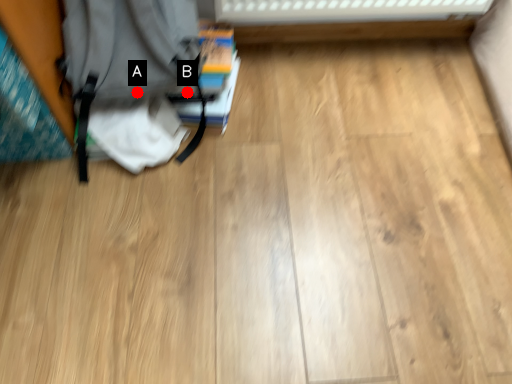
Question: Two points are circled on the image, labeled by A and B beside each circle. Which point appears farthest from the camera in this image?

Choices:
 (A) A is further
 (B) B is further

Answer: (B)